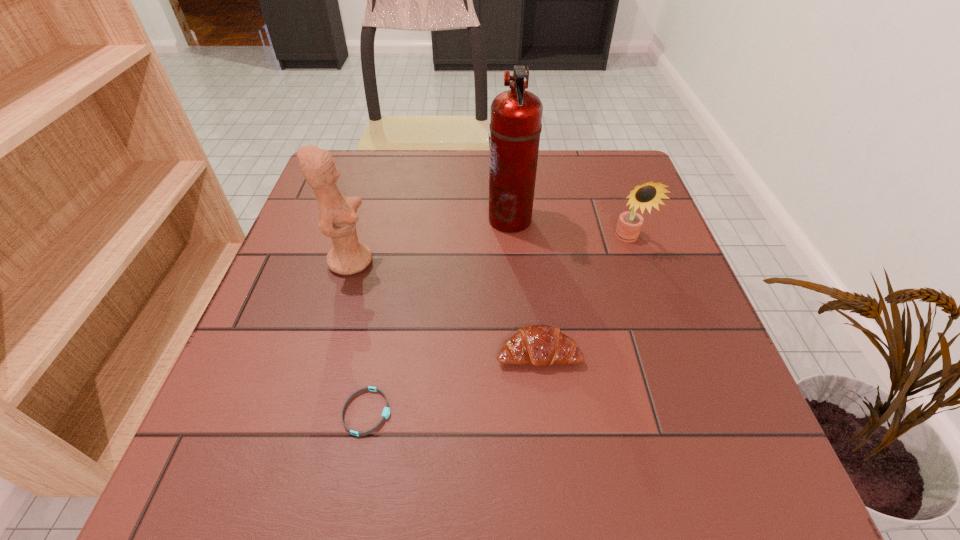
What are the coordinates of `vacant space located on the side of the fire extinguisher with the handle and hose` in the screenshot? It's located at (372, 219).

The image size is (960, 540). I want to click on free location located 0.280m on the side of the fire extinguisher with the handle and hose, so click(372, 219).

At what (x,y) coordinates should I click in order to perform the action: click on free space located on the front-facing side of the figurine. Please return your answer as a coordinate pair (x, y). Looking at the image, I should click on (492, 261).

At what (x,y) coordinates should I click in order to perform the action: click on vacant space located on the face of the rightmost object. Please return your answer as a coordinate pair (x, y). Image resolution: width=960 pixels, height=540 pixels. Looking at the image, I should click on (672, 364).

Identify the location of vacant space located 0.050m on the back of the fourth tallest object. (535, 314).

Image resolution: width=960 pixels, height=540 pixels. I want to click on vacant space situated 0.180m on the buckle of the shortest object, so click(501, 412).

This screenshot has height=540, width=960. Identify the location of object located at the left edge. (337, 219).

Where is `object that is at the right edge`? object that is at the right edge is located at coordinates (629, 225).

Identify the location of free region at the far edge of the desktop. The height and width of the screenshot is (540, 960). (564, 165).

Where is `vacant space at the left edge of the desktop`? vacant space at the left edge of the desktop is located at coordinates (274, 362).